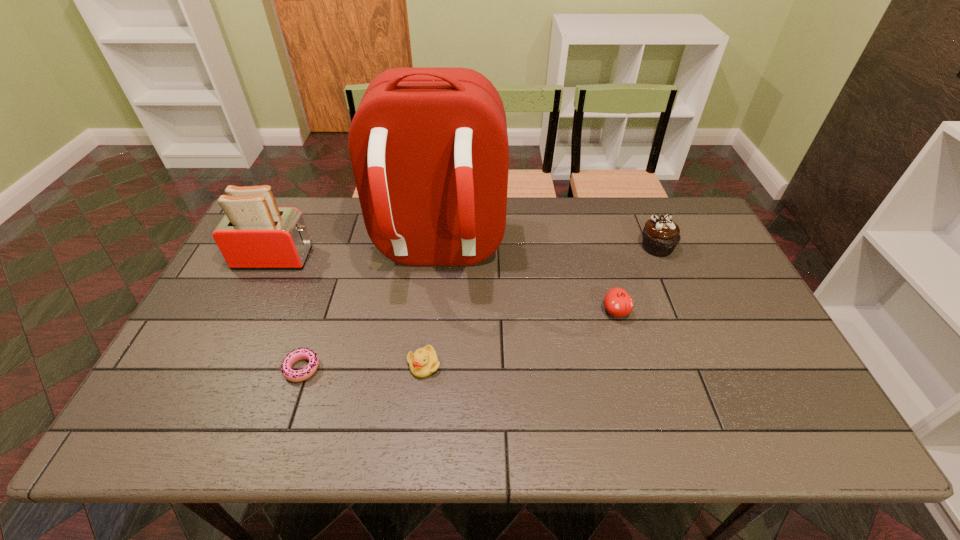
Where is `object that is at the far right corner`? This screenshot has width=960, height=540. object that is at the far right corner is located at coordinates tap(661, 235).

The image size is (960, 540). In the image, there is a desktop. Identify the location of vacant space at the far edge. (588, 205).

The width and height of the screenshot is (960, 540). Identify the location of vacant space at the near edge of the desktop. (513, 409).

You are a GUI agent. You are given a task and a screenshot of the screen. Output one action in this format:
    pyautogui.click(x=<x>, y=<y>)
    Task: Click on the free region at the right edge of the desktop
    This screenshot has height=540, width=960.
    Given the screenshot: What is the action you would take?
    pyautogui.click(x=752, y=361)

Locate an element on the screen. This screenshot has height=540, width=960. free space at the far right corner of the desktop is located at coordinates (659, 196).

Where is `vacant region between the fourth tallest object and the shortest object`? Image resolution: width=960 pixels, height=540 pixels. vacant region between the fourth tallest object and the shortest object is located at coordinates (459, 340).

This screenshot has width=960, height=540. What are the coordinates of `empty space that is in between the third tallest object and the second shortest object` in the screenshot? It's located at (540, 306).

At what (x,y) coordinates should I click in order to perform the action: click on free space between the third shortest object and the leftmost object. Please return your answer as a coordinate pair (x, y). The image size is (960, 540). Looking at the image, I should click on (445, 285).

Image resolution: width=960 pixels, height=540 pixels. I want to click on empty space that is in between the fifth object from left to right and the fourth shortest object, so click(x=636, y=280).

Find the location of a particular element. The width and height of the screenshot is (960, 540). vacant region between the duckling and the fifth object from right to left is located at coordinates [363, 367].